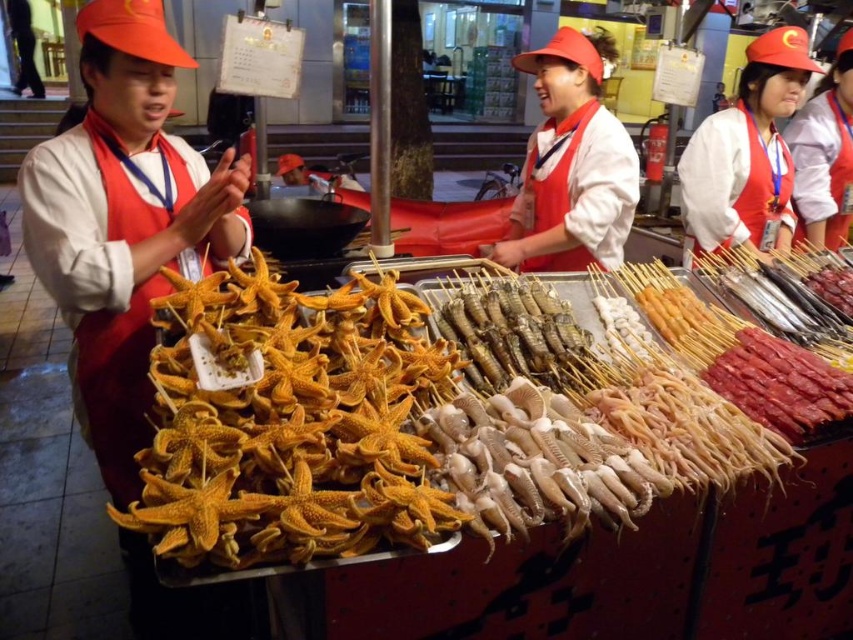
You are a customer at the night market stall. You notice the golden starfish at center and the matte red apron at center. Which object is taller?

The golden starfish at center is not as tall as the matte red apron at center, so the matte red apron at center is taller.

You are a customer at the night market stall. You see two points on the vendor tray. The first point is at coordinate point [315,420] and the second is at point [572,163]. Which point is closer to you?

Point [315,420] is in front of point [572,163], so it is closer to you.